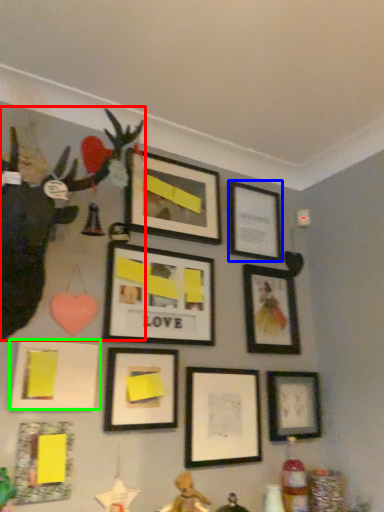
Question: Which object is the closest to the toy (highlighted by a red box)? Choose among these: picture frame (highlighted by a blue box) or picture frame (highlighted by a green box).

Choices:
 (A) picture frame
 (B) picture frame

Answer: (B)